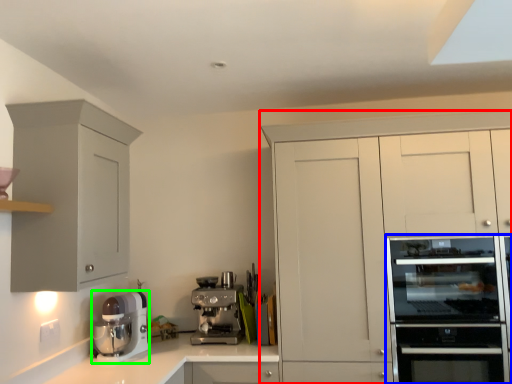
Question: Considering the real-world distances, which object is closest to cabinetry (highlighted by a red box)? home appliance (highlighted by a blue box) or kitchen appliance (highlighted by a green box).

Choices:
 (A) home appliance
 (B) kitchen appliance

Answer: (A)